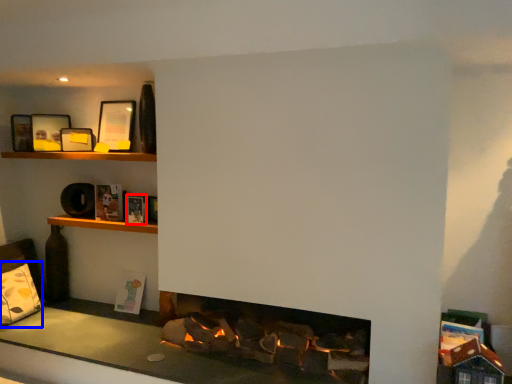
Question: Which point is closer to the camera, book (highlighted by a red box) or pillow (highlighted by a blue box)?

Choices:
 (A) book
 (B) pillow

Answer: (A)